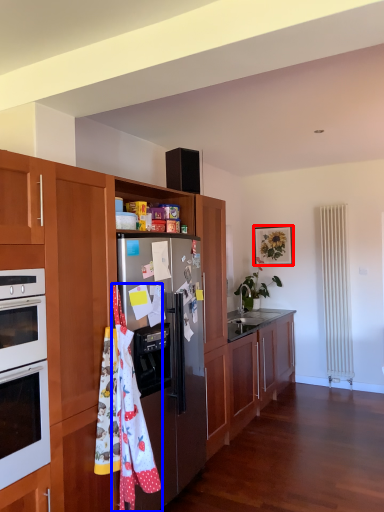
Question: Which object appears farthest to the camera in this image, picture frame (highlighted by a red box) or material (highlighted by a blue box)?

Choices:
 (A) picture frame
 (B) material

Answer: (A)